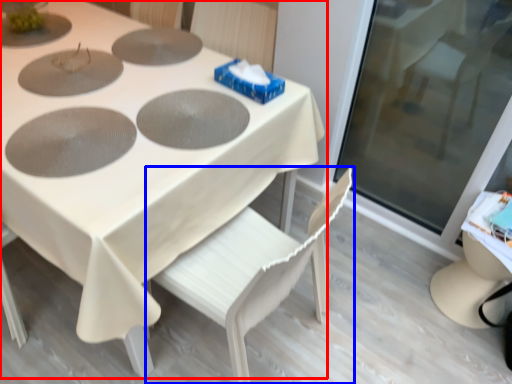
Question: Which of the following is the closest to the observer, table (highlighted by a red box) or chair (highlighted by a blue box)?

Choices:
 (A) table
 (B) chair

Answer: (B)